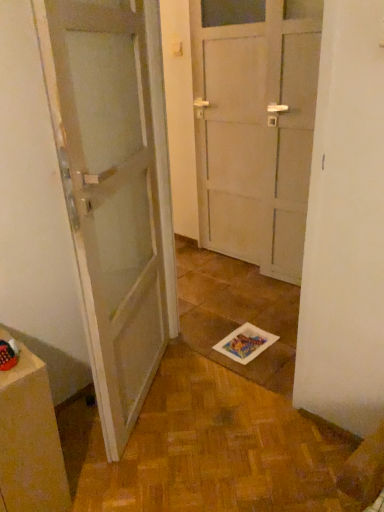
Question: Should I look upward or downward to see white glossy door at left?

Choices:
 (A) down
 (B) up

Answer: (B)

Question: Can you confirm if matte brown cabinet at lower left is shorter than white glossy door at left?

Choices:
 (A) no
 (B) yes

Answer: (B)

Question: Is the position of matte brown cabinet at lower left less distant than that of white glossy door at left?

Choices:
 (A) no
 (B) yes

Answer: (A)

Question: Can you confirm if matte brown cabinet at lower left is taller than white glossy door at left?

Choices:
 (A) no
 (B) yes

Answer: (A)

Question: Is matte brown cabinet at lower left smaller than white glossy door at left?

Choices:
 (A) yes
 (B) no

Answer: (A)

Question: From a real-world perspective, is matte brown cabinet at lower left physically below white glossy door at left?

Choices:
 (A) no
 (B) yes

Answer: (B)

Question: Can we say matte brown cabinet at lower left lies outside white glossy door at left?

Choices:
 (A) no
 (B) yes

Answer: (B)

Question: Is the position of white glossy door at left less distant than that of matte brown cabinet at lower left?

Choices:
 (A) no
 (B) yes

Answer: (B)

Question: Does white glossy door at left appear on the left side of matte brown cabinet at lower left?

Choices:
 (A) yes
 (B) no

Answer: (B)

Question: Can you confirm if white glossy door at left is bigger than matte brown cabinet at lower left?

Choices:
 (A) yes
 (B) no

Answer: (A)

Question: From the image's perspective, is white glossy door at left located beneath matte brown cabinet at lower left?

Choices:
 (A) yes
 (B) no

Answer: (B)

Question: From the image's perspective, is white glossy door at left over matte brown cabinet at lower left?

Choices:
 (A) yes
 (B) no

Answer: (A)

Question: Considering the relative sizes of white glossy door at left and matte brown cabinet at lower left in the image provided, is white glossy door at left thinner than matte brown cabinet at lower left?

Choices:
 (A) no
 (B) yes

Answer: (B)

Question: From the image's perspective, is white glossy door at left above or below matte brown cabinet at lower left?

Choices:
 (A) below
 (B) above

Answer: (B)